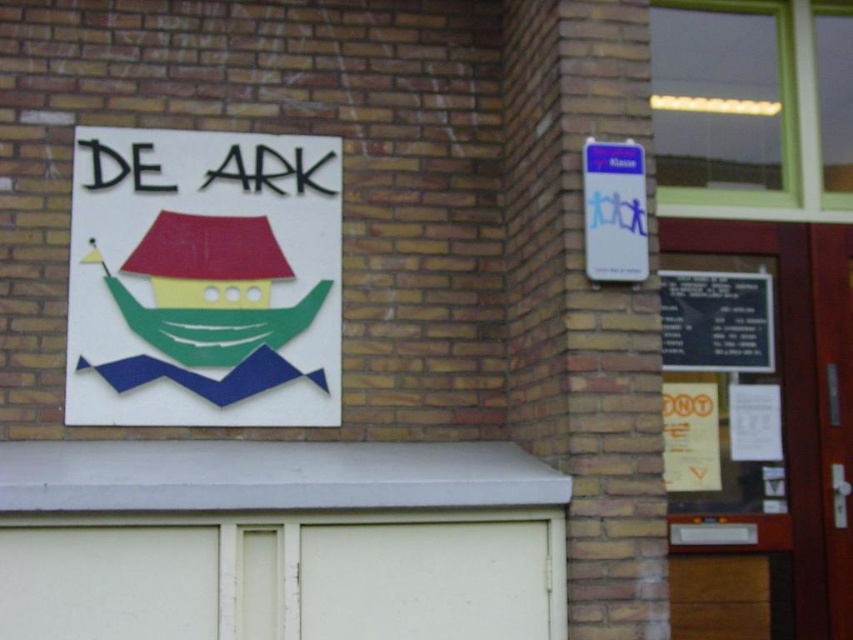
You are a delivery person trying to park your van in front of the building. The van is 2 meters wide. The white matte garage door at lower center and the black matte signboard at right are visible. Can you fit your van through the space between them?

The white matte garage door at lower center is wider than the black matte signboard at right. Since the garage door is wider, there might be enough space for the van to pass through between them. However, exact dimensions aren

You are standing in front of the brick building and want to enter the garage. The garage door is white matte garage door at lower center. To your right, there is a black matte signboard at right. Which direction should you move to reach the garage door from the signboard?

The white matte garage door at lower center is to the left of the black matte signboard at right. So, to reach the garage door from the signboard, you should move to your left.

You are a delivery person who needs to place a 25 inch wide box between the matte plastic sign at upper left and the blue paper sign at upper right. Will the box fit horizontally between them?

The distance between the matte plastic sign at upper left and the blue paper sign at upper right is 24.95 inches, so the 25 inch box will not fit horizontally between them as it is slightly wider than the available space.